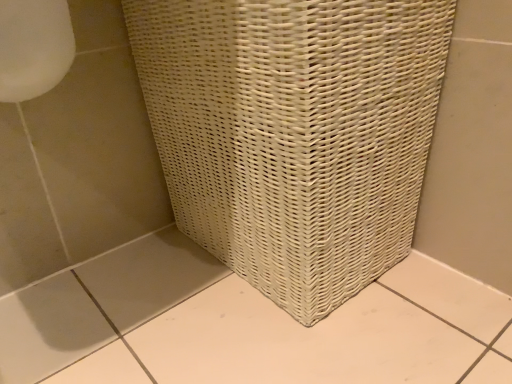
Describe the element at coordinates (294, 133) in the screenshot. I see `white wicker basket at center` at that location.

Locate an element on the screen. white wicker basket at center is located at coordinates (294, 133).

Measure the distance between white wicker basket at center and camera.

A: The depth of white wicker basket at center is 18.00 inches.

This screenshot has height=384, width=512. Find the location of `white wicker basket at center`. white wicker basket at center is located at coordinates (294, 133).